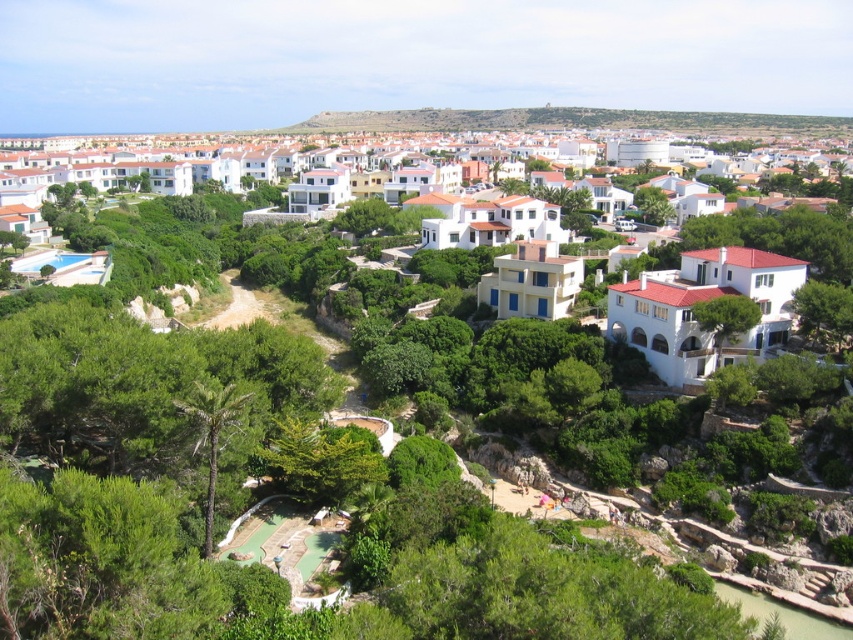
You are a drone operator trying to capture aerial footage of the white matte houses at center and the green leafy palm at lower left. From your current position above the scene, which object would appear closer to the camera?

The green leafy palm at lower left appears closer to the camera because it is positioned below the white matte houses at center, meaning it is closer to the observer from an aerial viewpoint.